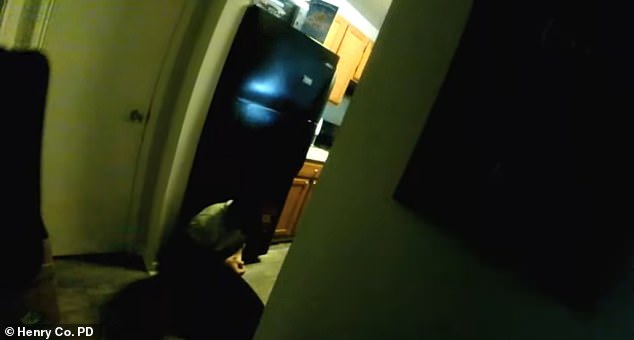
I want to click on white wall on right, so click(x=413, y=44), click(x=353, y=300), click(x=495, y=315).